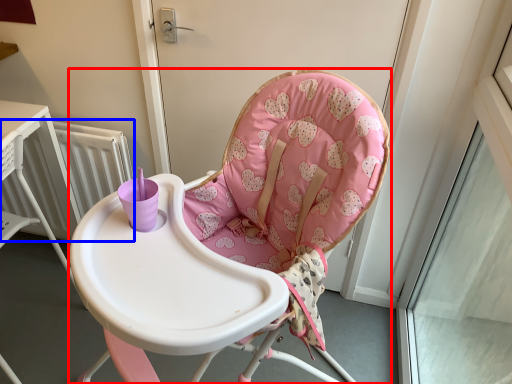
Question: Which of the following is the farthest to the observer, chair (highlighted by a red box) or radiator (highlighted by a blue box)?

Choices:
 (A) chair
 (B) radiator

Answer: (B)